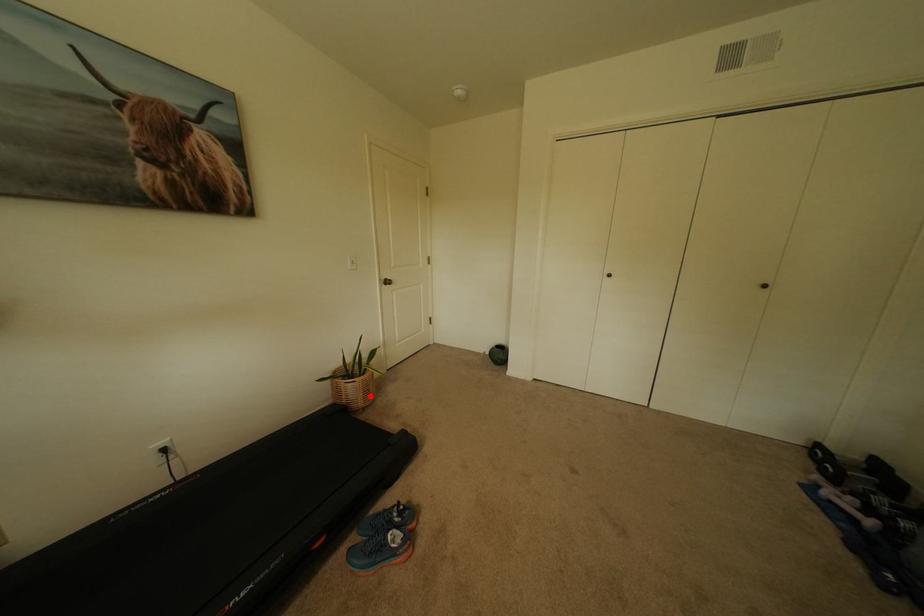
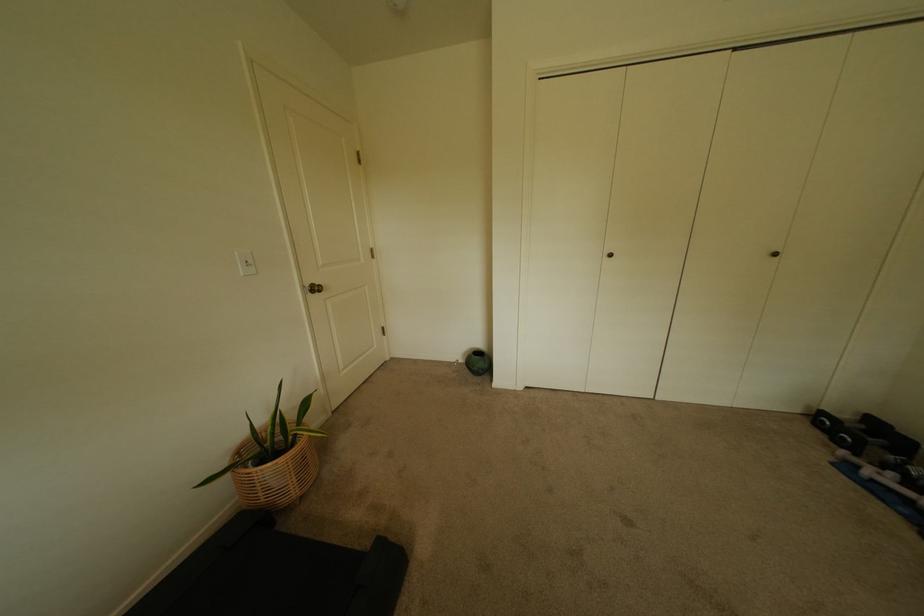
Question: A red point is marked in image1. In image2, is the corresponding 3D point closer to the camera or farther? Reply with the corresponding letter.

Choices:
 (A) The corresponding 3D point is closer.
 (B) The corresponding 3D point is farther.

Answer: (B)